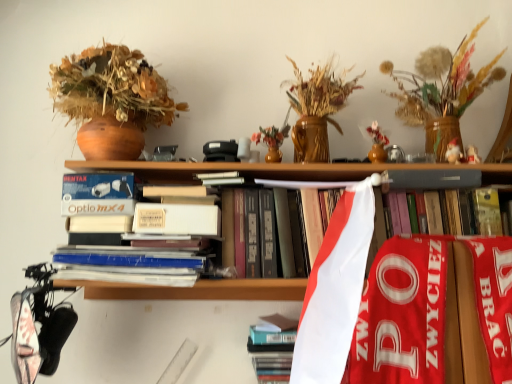
Question: Which direction should I rotate to look at hardcover book at center, which is counted as the 1th book, starting from the top, — up or down?

Choices:
 (A) up
 (B) down

Answer: (B)

Question: Is hardcover book at center, marked as the 1th book in a bottom-to-top arrangement, thinner than wooden vase with dried flowers at upper right?

Choices:
 (A) no
 (B) yes

Answer: (B)

Question: Considering the relative positions of hardcover book at center, which ranks as the 2th book in top-to-bottom order, and wooden vase with dried flowers at upper right in the image provided, is hardcover book at center, which ranks as the 2th book in top-to-bottom order, to the right of wooden vase with dried flowers at upper right from the viewer's perspective?

Choices:
 (A) no
 (B) yes

Answer: (A)

Question: Considering the relative sizes of hardcover book at center, marked as the 1th book in a bottom-to-top arrangement, and wooden vase with dried flowers at upper right in the image provided, is hardcover book at center, marked as the 1th book in a bottom-to-top arrangement, taller than wooden vase with dried flowers at upper right?

Choices:
 (A) yes
 (B) no

Answer: (B)

Question: Does hardcover book at center, marked as the 1th book in a bottom-to-top arrangement, have a greater width compared to wooden vase with dried flowers at upper right?

Choices:
 (A) no
 (B) yes

Answer: (A)

Question: Is hardcover book at center, which ranks as the 2th book in top-to-bottom order, positioned behind wooden vase with dried flowers at upper right?

Choices:
 (A) no
 (B) yes

Answer: (B)

Question: Is hardcover book at center, marked as the 1th book in a bottom-to-top arrangement, far from wooden vase with dried flowers at upper right?

Choices:
 (A) no
 (B) yes

Answer: (A)

Question: Considering the relative positions of matte brown vase at upper left and wooden vase with dried flowers at upper right in the image provided, is matte brown vase at upper left in front of wooden vase with dried flowers at upper right?

Choices:
 (A) yes
 (B) no

Answer: (B)

Question: Would you say matte brown vase at upper left is outside wooden vase with dried flowers at upper right?

Choices:
 (A) yes
 (B) no

Answer: (A)

Question: Is matte brown vase at upper left to the right of wooden vase with dried flowers at upper right from the viewer's perspective?

Choices:
 (A) yes
 (B) no

Answer: (B)

Question: Considering the relative sizes of matte brown vase at upper left and wooden vase with dried flowers at upper right in the image provided, is matte brown vase at upper left shorter than wooden vase with dried flowers at upper right?

Choices:
 (A) no
 (B) yes

Answer: (A)

Question: Considering the relative sizes of matte brown vase at upper left and wooden vase with dried flowers at upper right in the image provided, is matte brown vase at upper left thinner than wooden vase with dried flowers at upper right?

Choices:
 (A) no
 (B) yes

Answer: (B)

Question: Does matte brown vase at upper left have a smaller size compared to wooden vase with dried flowers at upper right?

Choices:
 (A) no
 (B) yes

Answer: (A)

Question: Does hardcover book at center, which ranks as the 2th book in top-to-bottom order, have a larger size compared to matte brown vase at upper left?

Choices:
 (A) no
 (B) yes

Answer: (A)